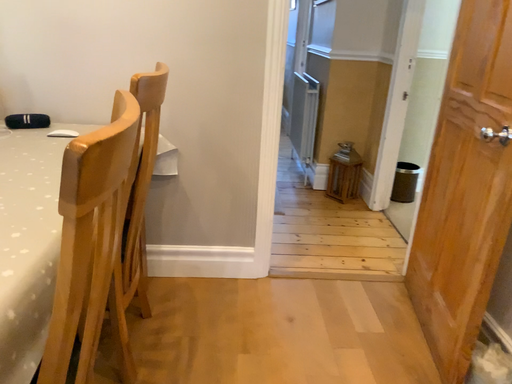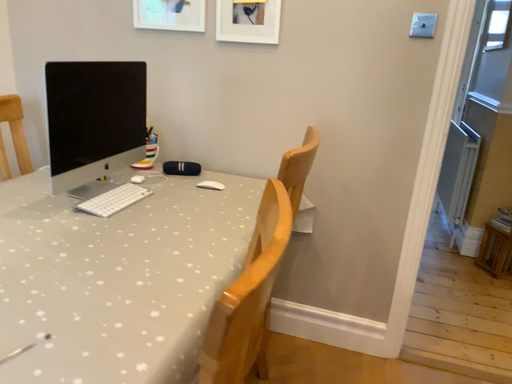
Question: Which way did the camera rotate in the video?

Choices:
 (A) rotated left
 (B) rotated right

Answer: (A)